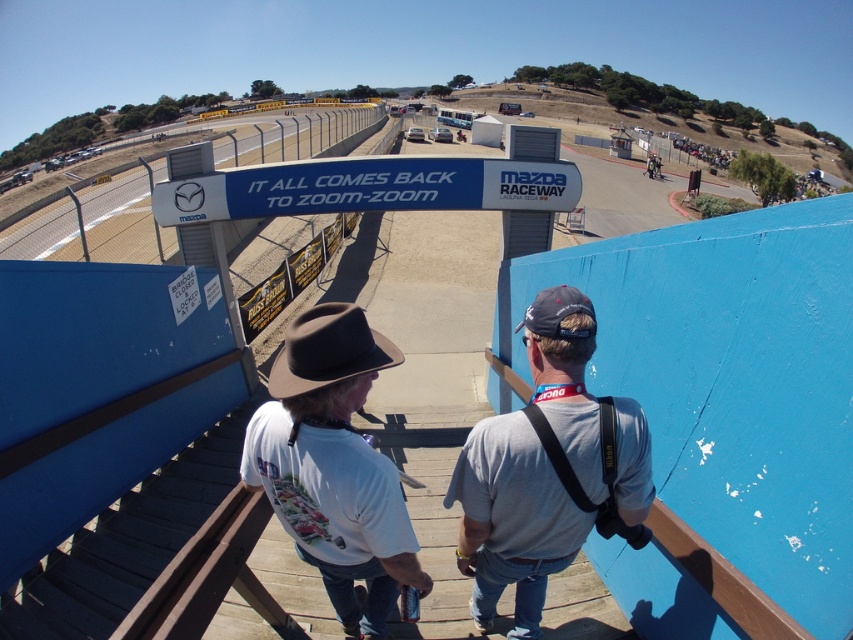
You are standing at the Mazda Raceway entrance and want to take a photo of the two points marked in the image. Which point, point (485, 611) or point (416, 168), is closer to you?

Point (485, 611) is closer to the viewer than point (416, 168).